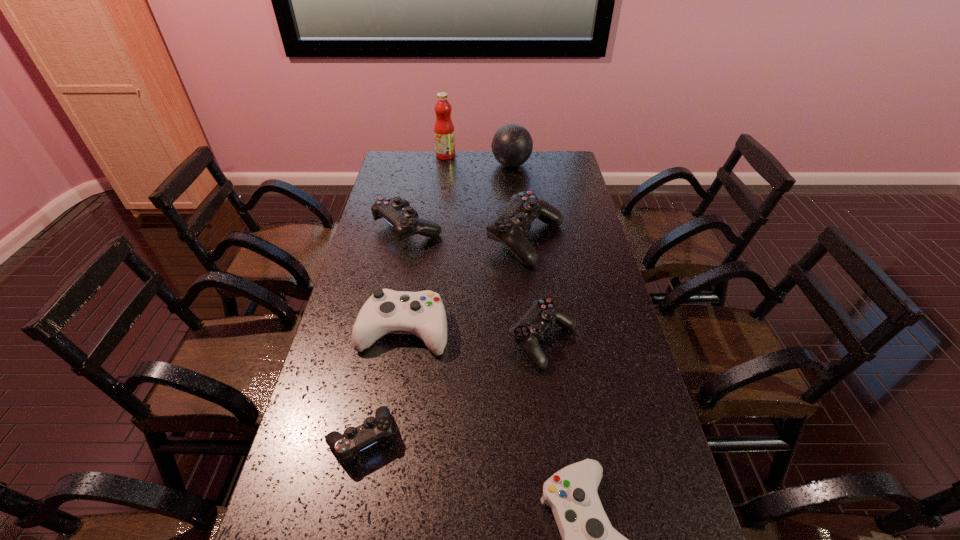
I want to click on object that stands as the fifth closest to the smaller white control, so click(397, 212).

This screenshot has height=540, width=960. I want to click on object that is the fourth closest to the fruit juice, so tap(422, 313).

You are a GUI agent. You are given a task and a screenshot of the screen. Output one action in this format:
    pyautogui.click(x=<x>, y=<y>)
    Task: Click on the control that is the closest to the second biggest black control
    The image size is (960, 540).
    Given the screenshot: What is the action you would take?
    pyautogui.click(x=509, y=227)

Identify the location of control object that ranks as the closest to the third biggest black control. (422, 313).

This screenshot has height=540, width=960. In order to click on black control that is the fourth closest one to the pink fruit juice in this screenshot , I will do `click(374, 429)`.

Identify which black control is the nearest to the biggest black control. Please provide its 2D coordinates. Your answer should be formatted as a tuple, i.e. [(x, y)], where the tuple contains the x and y coordinates of a point satisfying the conditions above.

[(397, 212)]

Locate an element on the screen. The height and width of the screenshot is (540, 960). white control that is the closest one to the biggest black control is located at coordinates (422, 313).

This screenshot has width=960, height=540. Find the location of `the closest white control relative to the third farthest black control`. the closest white control relative to the third farthest black control is located at coordinates (422, 313).

Locate an element on the screen. This screenshot has width=960, height=540. blank area in the image that satisfies the following two spatial constraints: 1. on the back side of the nearest black control; 2. on the left side of the second smallest black control is located at coordinates (382, 341).

The height and width of the screenshot is (540, 960). Identify the location of free space that satisfies the following two spatial constraints: 1. on the back side of the smallest black control; 2. on the left side of the left white control. (385, 330).